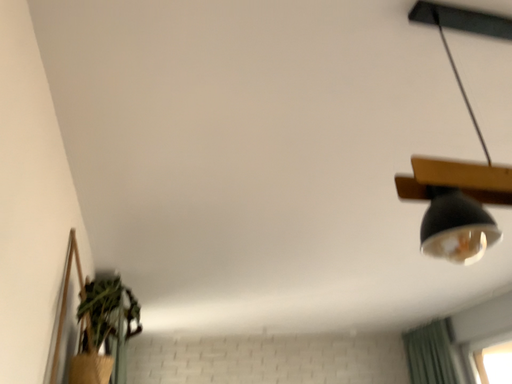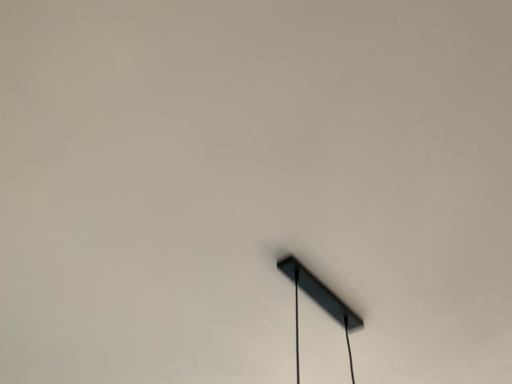
Question: Which way did the camera rotate in the video?

Choices:
 (A) rotated upward
 (B) rotated downward

Answer: (A)